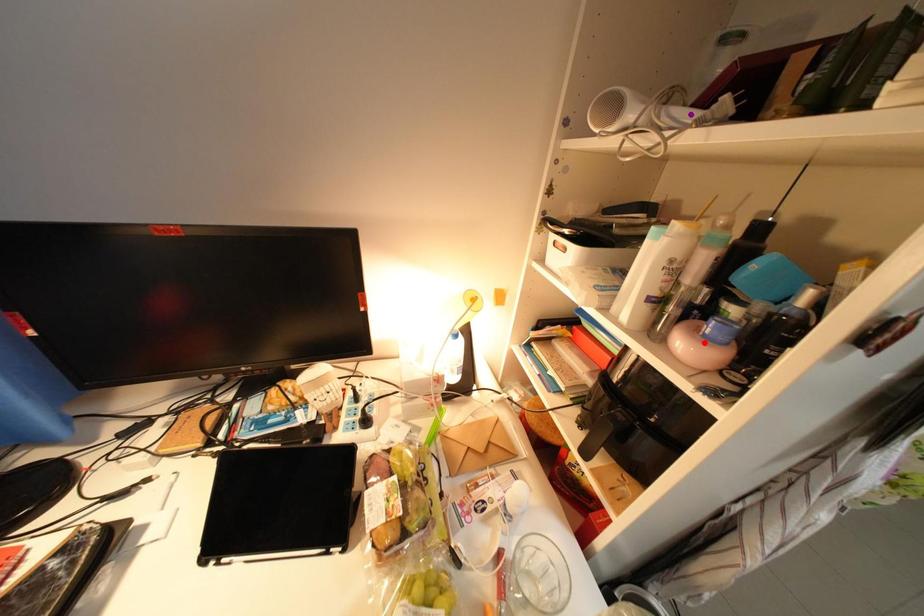
Order these from nearest to farthest:
red point, purple point, orange point

purple point < red point < orange point